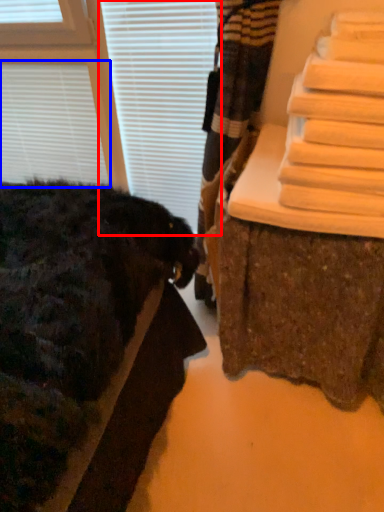
Question: Which object appears farthest to the camera in this image, blind (highlighted by a red box) or blind (highlighted by a blue box)?

Choices:
 (A) blind
 (B) blind

Answer: (B)